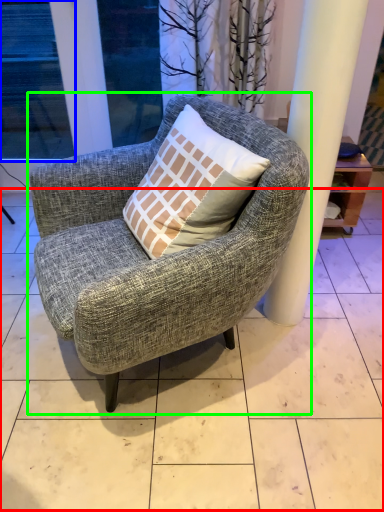
Question: Which object is positioned farthest from tile (highlighted by a red box)? Select from window (highlighted by a blue box) and chair (highlighted by a green box).

Choices:
 (A) window
 (B) chair

Answer: (A)